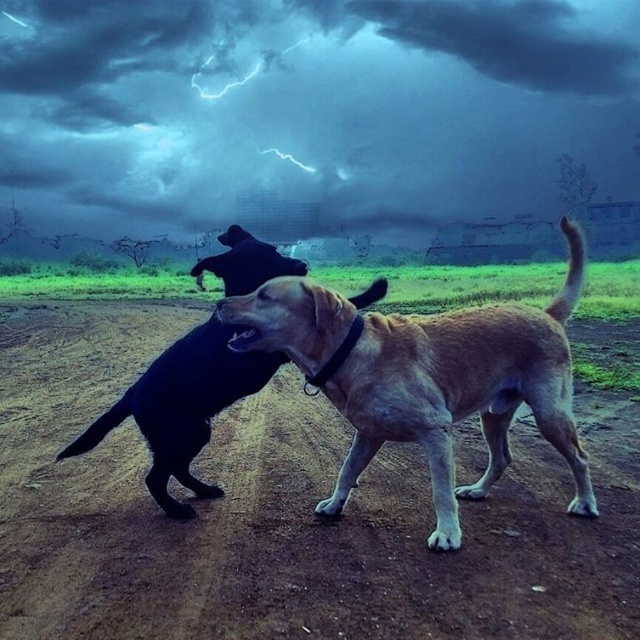
Who is more distant from viewer, (323, 99) or (193, 596)?

Point (323, 99)

Where is `dark cloudy sky at upper center`? Image resolution: width=640 pixels, height=640 pixels. dark cloudy sky at upper center is located at coordinates (312, 109).

Does brown dirt field at center have a greater width compared to light brown fur dog at center?

No.

Is point (580, 573) in front of point (356, 346)?

Yes, point (580, 573) is closer to viewer.

The height and width of the screenshot is (640, 640). I want to click on brown dirt field at center, so click(x=284, y=513).

In the scene shown: Can you confirm if light brown fur dog at center is thinner than shiny black dog at center?

Correct, light brown fur dog at center's width is less than shiny black dog at center's.

Can you confirm if light brown fur dog at center is positioned below shiny black dog at center?

Incorrect, light brown fur dog at center is not positioned below shiny black dog at center.

Image resolution: width=640 pixels, height=640 pixels. Find the location of `light brown fur dog at center`. light brown fur dog at center is located at coordinates (429, 378).

You are a GUI agent. You are given a task and a screenshot of the screen. Output one action in this format:
    pyautogui.click(x=<x>, y=<y>)
    Task: Click on the light brown fur dog at center
    The height and width of the screenshot is (640, 640).
    Given the screenshot: What is the action you would take?
    pyautogui.click(x=429, y=378)